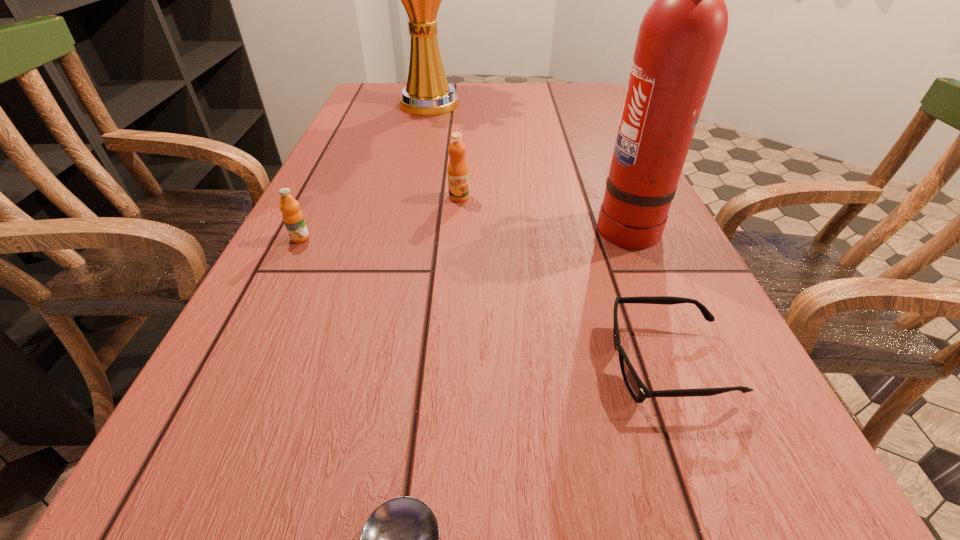
This screenshot has width=960, height=540. I want to click on trophy_cup, so click(x=427, y=93).

What are the coordinates of `the farthest object` in the screenshot? It's located at (427, 93).

Locate an element on the screen. the fifth shortest object is located at coordinates (x=680, y=38).

Find the location of a particular element. the right orange juice is located at coordinates (457, 171).

Locate an element on the screen. the third tallest object is located at coordinates (457, 171).

Where is `the leftmost object`? The height and width of the screenshot is (540, 960). the leftmost object is located at coordinates (292, 216).

Identify the location of the shorter orange juice. (292, 216).

Image resolution: width=960 pixels, height=540 pixels. Identify the location of the second shortest object. (639, 392).

Identify the location of sunglasses. (639, 392).

Identify the location of blank space located 0.230m at the front of the farthest object where the globe is prominent. This screenshot has height=540, width=960. (417, 163).